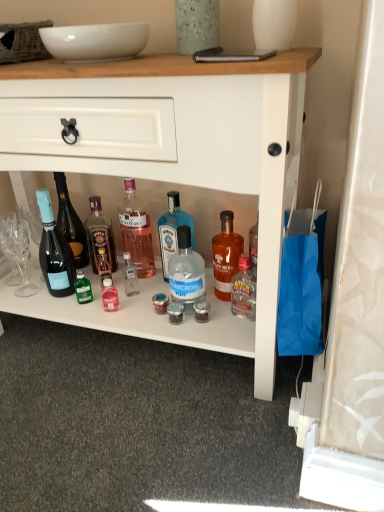
Locate an element on the screen. This screenshot has width=384, height=512. translucent glass bottle at center, which is the 5th bottle in right-to-left order is located at coordinates (100, 234).

This screenshot has height=512, width=384. Identify the location of blue glass bottle at center, which ranks as the fourth bottle in left-to-right order. (172, 230).

Measure the distance between pink glass bottle at center, which is counted as the third bottle, starting from the left, and camera.

3.95 feet.

What is the approximate height of white glossy cabinet at center?

28.38 inches.

What do you see at coordinates (173, 139) in the screenshot? I see `white glossy cabinet at center` at bounding box center [173, 139].

Locate an element on the screen. Image resolution: width=384 pixels, height=512 pixels. clear glass bottle at center, the 5th bottle when ordered from left to right is located at coordinates [x=186, y=271].

Does white glossy vase at upper center, the 2th glass vase in the left-to-right sequence, have a larger size compared to matte black champagne bottle at left, which is the first bottle in left-to-right order?

Correct, white glossy vase at upper center, the 2th glass vase in the left-to-right sequence, is larger in size than matte black champagne bottle at left, which is the first bottle in left-to-right order.

Between white glossy vase at upper center, the first glass vase in the right-to-left sequence, and matte black champagne bottle at left, which is the first bottle in left-to-right order, which one has larger width?

With larger width is white glossy vase at upper center, the first glass vase in the right-to-left sequence.

Identify the location of the 1st glass vase positioned above the matte black champagne bottle at left, the sixth bottle positioned from the right (from a real-world perspective). (274, 24).

Is matte black champagne bottle at left, the sixth bottle positioned from the right, inside white glossy bowl at upper center?

No, matte black champagne bottle at left, the sixth bottle positioned from the right, is not surrounded by white glossy bowl at upper center.

Can you tell me how much white glossy bowl at upper center and matte black champagne bottle at left, the sixth bottle positioned from the right, differ in facing direction?

The angular difference between white glossy bowl at upper center and matte black champagne bottle at left, the sixth bottle positioned from the right, is 12.4 degrees.

Does white glossy bowl at upper center appear on the right side of matte black champagne bottle at left, which is the first bottle in left-to-right order?

Correct, you'll find white glossy bowl at upper center to the right of matte black champagne bottle at left, which is the first bottle in left-to-right order.

Can you confirm if white glossy bowl at upper center is bigger than matte black champagne bottle at left, which is the first bottle in left-to-right order?

Actually, white glossy bowl at upper center might be smaller than matte black champagne bottle at left, which is the first bottle in left-to-right order.

From the image's perspective, is white glossy vase at upper center, the first glass vase in the right-to-left sequence, located beneath blue glass bottle at center, which ranks as the fourth bottle in left-to-right order?

No, from the image's perspective, white glossy vase at upper center, the first glass vase in the right-to-left sequence, is not beneath blue glass bottle at center, which ranks as the fourth bottle in left-to-right order.

Between white glossy vase at upper center, the 2th glass vase in the left-to-right sequence, and blue glass bottle at center, acting as the 3th bottle starting from the right, which one has smaller size?

white glossy vase at upper center, the 2th glass vase in the left-to-right sequence.

Is point (257, 16) farther from camera compared to point (177, 215)?

That is False.

Considering the sizes of objects white glossy vase at upper center, the first glass vase in the right-to-left sequence, and blue glass bottle at center, which ranks as the fourth bottle in left-to-right order, in the image provided, who is shorter, white glossy vase at upper center, the first glass vase in the right-to-left sequence, or blue glass bottle at center, which ranks as the fourth bottle in left-to-right order,?

white glossy vase at upper center, the first glass vase in the right-to-left sequence.

Is white glossy vase at upper center, the first glass vase in the right-to-left sequence, wider than matte orange glass bottle at center, acting as the sixth bottle starting from the left?

Indeed, white glossy vase at upper center, the first glass vase in the right-to-left sequence, has a greater width compared to matte orange glass bottle at center, acting as the sixth bottle starting from the left.

Does point (257, 8) come farther from viewer compared to point (214, 272)?

No, (257, 8) is in front of (214, 272).

From the image's perspective, which is above, white glossy vase at upper center, the 2th glass vase in the left-to-right sequence, or matte orange glass bottle at center, which is the 1th bottle from right to left?

white glossy vase at upper center, the 2th glass vase in the left-to-right sequence, from the image's perspective.

Between white glossy vase at upper center, the first glass vase in the right-to-left sequence, and matte orange glass bottle at center, which is the 1th bottle from right to left, which one appears on the left side from the viewer's perspective?

matte orange glass bottle at center, which is the 1th bottle from right to left.

I want to click on bowl below the speckled glass vase at upper center, acting as the first glass vase starting from the left (from a real-world perspective), so click(x=95, y=41).

Is white glossy bowl at upper center outside of speckled glass vase at upper center, acting as the first glass vase starting from the left?

Yes, white glossy bowl at upper center is located beyond the bounds of speckled glass vase at upper center, acting as the first glass vase starting from the left.

Can you confirm if white glossy bowl at upper center is taller than speckled glass vase at upper center, acting as the first glass vase starting from the left?

No, white glossy bowl at upper center is not taller than speckled glass vase at upper center, acting as the first glass vase starting from the left.

Does white glossy cabinet at center have a lesser width compared to clear glass bottle at center, which is the second bottle from right to left?

No.

Is white glossy cabinet at center not near clear glass bottle at center, which is the second bottle from right to left?

white glossy cabinet at center is actually quite close to clear glass bottle at center, which is the second bottle from right to left.

Is white glossy cabinet at center located outside clear glass bottle at center, which is the second bottle from right to left?

Yes.

From a real-world perspective, relative to clear glass bottle at center, which is the second bottle from right to left, is white glossy cabinet at center vertically above or below?

From a real-world perspective, white glossy cabinet at center is physically above clear glass bottle at center, which is the second bottle from right to left.

Based on the photo, measure the distance between white glossy vase at upper center, the 2th glass vase in the left-to-right sequence, and speckled glass vase at upper center, which appears as the 2th glass vase when viewed from the right.

They are 4.89 inches apart.

In terms of width, does white glossy vase at upper center, the first glass vase in the right-to-left sequence, look wider or thinner when compared to speckled glass vase at upper center, acting as the first glass vase starting from the left?

In the image, white glossy vase at upper center, the first glass vase in the right-to-left sequence, appears to be wider than speckled glass vase at upper center, acting as the first glass vase starting from the left.

From the image's perspective, between white glossy vase at upper center, the 2th glass vase in the left-to-right sequence, and speckled glass vase at upper center, acting as the first glass vase starting from the left, who is located below?

white glossy vase at upper center, the 2th glass vase in the left-to-right sequence, from the image's perspective.

Is there a large distance between white glossy vase at upper center, the 2th glass vase in the left-to-right sequence, and speckled glass vase at upper center, which appears as the 2th glass vase when viewed from the right?

No.

The image size is (384, 512). In order to click on the 1st bottle located beneath the white glossy vase at upper center, the first glass vase in the right-to-left sequence (from a real-world perspective) in this screenshot , I will do `click(54, 251)`.

Find the location of `the 2nd bottle to the left when counting from the white glossy bowl at upper center`. the 2nd bottle to the left when counting from the white glossy bowl at upper center is located at coordinates (54, 251).

Looking at the image, which one is located closer to pink glass bottle at center, which is counted as the 4th bottle, starting from the right, white glossy bowl at upper center or clear glass bottle at center, which is the second bottle from right to left?

Based on the image, clear glass bottle at center, which is the second bottle from right to left, appears to be nearer to pink glass bottle at center, which is counted as the 4th bottle, starting from the right.

Considering their positions, is matte orange glass bottle at center, which is the 1th bottle from right to left, positioned further to clear glass bottle at center, which is the second bottle from right to left, than white glossy bowl at upper center?

white glossy bowl at upper center lies further to clear glass bottle at center, which is the second bottle from right to left, than the other object.

Considering their positions, is matte orange glass bottle at center, which is the 1th bottle from right to left, positioned further to matte black champagne bottle at left, the sixth bottle positioned from the right, than white glossy cabinet at center?

matte orange glass bottle at center, which is the 1th bottle from right to left, is further to matte black champagne bottle at left, the sixth bottle positioned from the right.

When comparing their distances from pink glass bottle at center, which is counted as the 4th bottle, starting from the right, does blue glass bottle at center, acting as the 3th bottle starting from the right, or speckled glass vase at upper center, acting as the first glass vase starting from the left, seem further?

Based on the image, speckled glass vase at upper center, acting as the first glass vase starting from the left, appears to be further to pink glass bottle at center, which is counted as the 4th bottle, starting from the right.

Considering their positions, is translucent glass bottle at center, which is the 5th bottle in right-to-left order, positioned closer to white glossy bowl at upper center than matte orange glass bottle at center, acting as the sixth bottle starting from the left?

Among the two, translucent glass bottle at center, which is the 5th bottle in right-to-left order, is located nearer to white glossy bowl at upper center.

When comparing their distances from blue glass bottle at center, which ranks as the fourth bottle in left-to-right order, does translucent glass bottle at center, arranged as the 2th bottle when viewed from the left, or white glossy vase at upper center, the 2th glass vase in the left-to-right sequence, seem further?

Based on the image, white glossy vase at upper center, the 2th glass vase in the left-to-right sequence, appears to be further to blue glass bottle at center, which ranks as the fourth bottle in left-to-right order.

When comparing their distances from white glossy bowl at upper center, does white glossy vase at upper center, the first glass vase in the right-to-left sequence, or blue glass bottle at center, which ranks as the fourth bottle in left-to-right order, seem closer?

white glossy vase at upper center, the first glass vase in the right-to-left sequence, lies closer to white glossy bowl at upper center than the other object.

Which object lies nearer to the anchor point speckled glass vase at upper center, acting as the first glass vase starting from the left, white glossy vase at upper center, the 2th glass vase in the left-to-right sequence, or white glossy bowl at upper center?

The object closer to speckled glass vase at upper center, acting as the first glass vase starting from the left, is white glossy vase at upper center, the 2th glass vase in the left-to-right sequence.

Find the location of a particular element. bowl between speckled glass vase at upper center, acting as the first glass vase starting from the left, and matte black champagne bottle at left, which is the first bottle in left-to-right order, from top to bottom is located at coordinates (95, 41).

This screenshot has width=384, height=512. In order to click on desk situated between matte black champagne bottle at left, the sixth bottle positioned from the right, and matte orange glass bottle at center, which is the 1th bottle from right to left, from left to right in this screenshot , I will do `click(173, 139)`.

Find the location of a particular element. bowl located between matte black champagne bottle at left, which is the first bottle in left-to-right order, and white glossy vase at upper center, the first glass vase in the right-to-left sequence, in the left-right direction is located at coordinates (95, 41).

Find the location of a particular element. The image size is (384, 512). bowl between white glossy vase at upper center, the first glass vase in the right-to-left sequence, and translucent glass bottle at center, arranged as the 2th bottle when viewed from the left, from top to bottom is located at coordinates (95, 41).